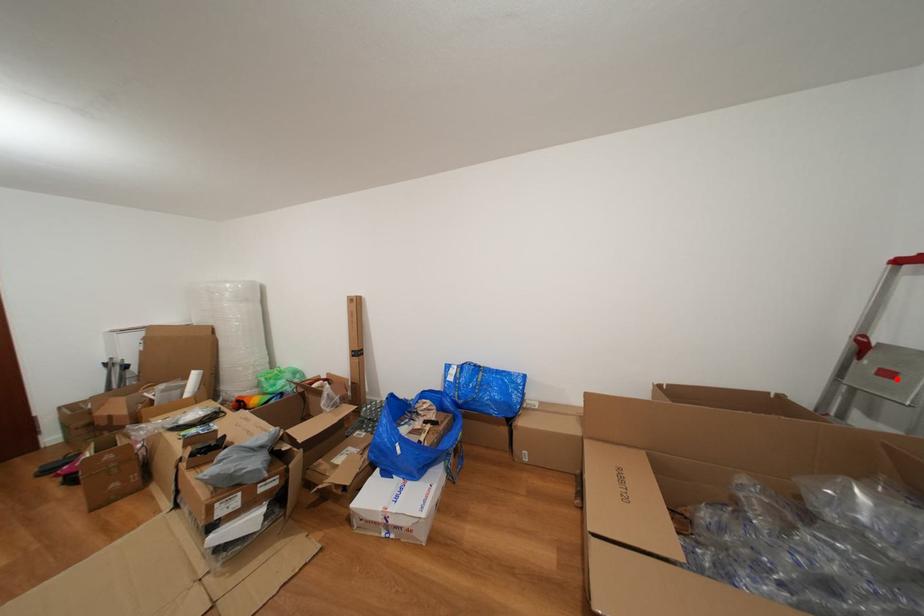
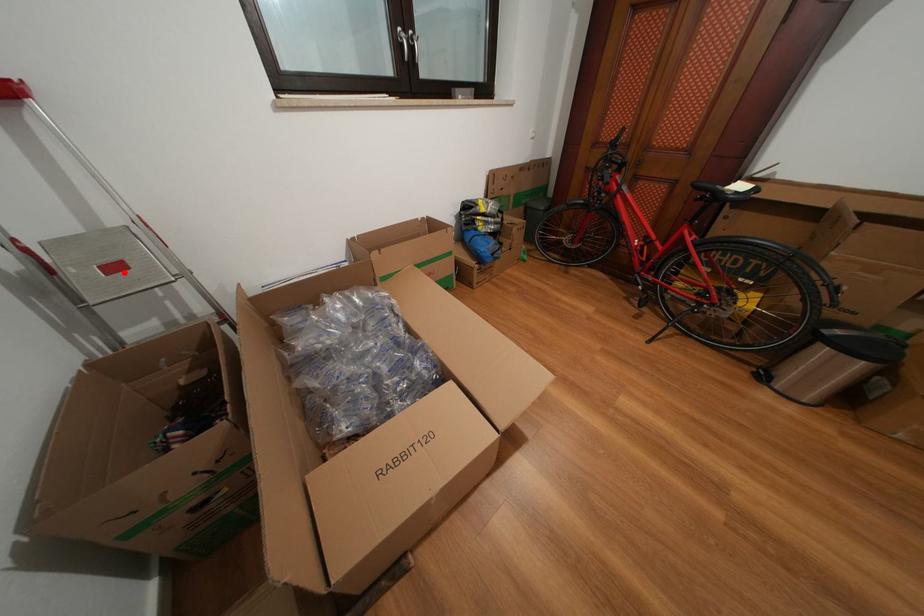
I am providing you with two images of the same scene from different viewpoints. A red point is marked on the first image and another point is marked on the second image. Is the red point in image1 aligned with the point shown in image2?

Yes